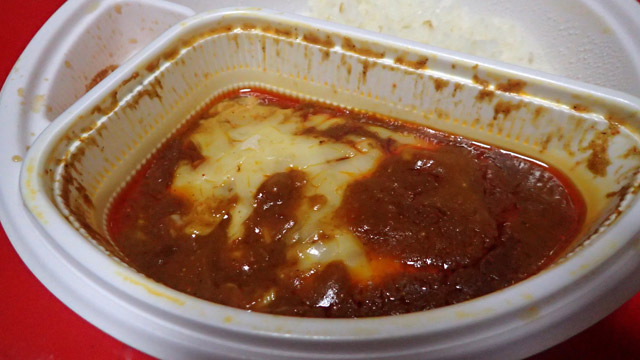
The image size is (640, 360). Identify the location of table cloth. (36, 327).